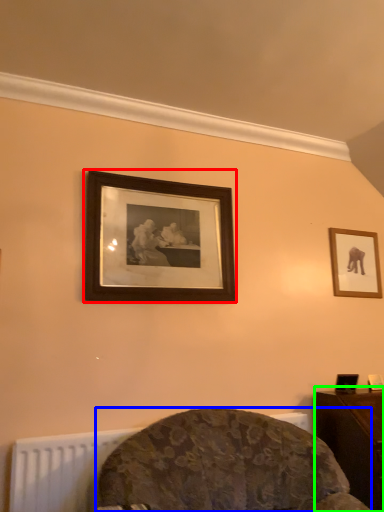
Question: Considering the real-world distances, which object is farthest from picture frame (highlighted by a red box)? furniture (highlighted by a blue box) or table (highlighted by a green box)?

Choices:
 (A) furniture
 (B) table

Answer: (B)